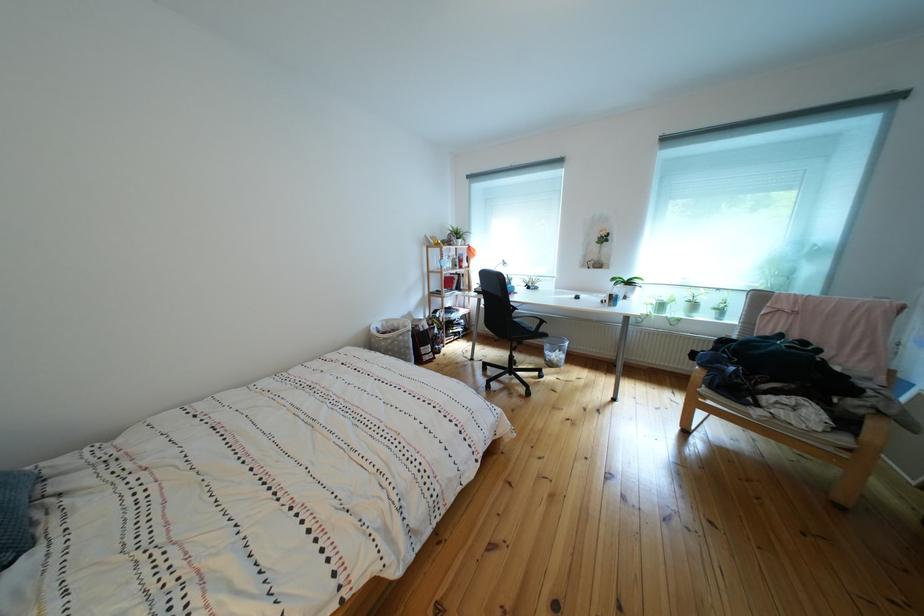
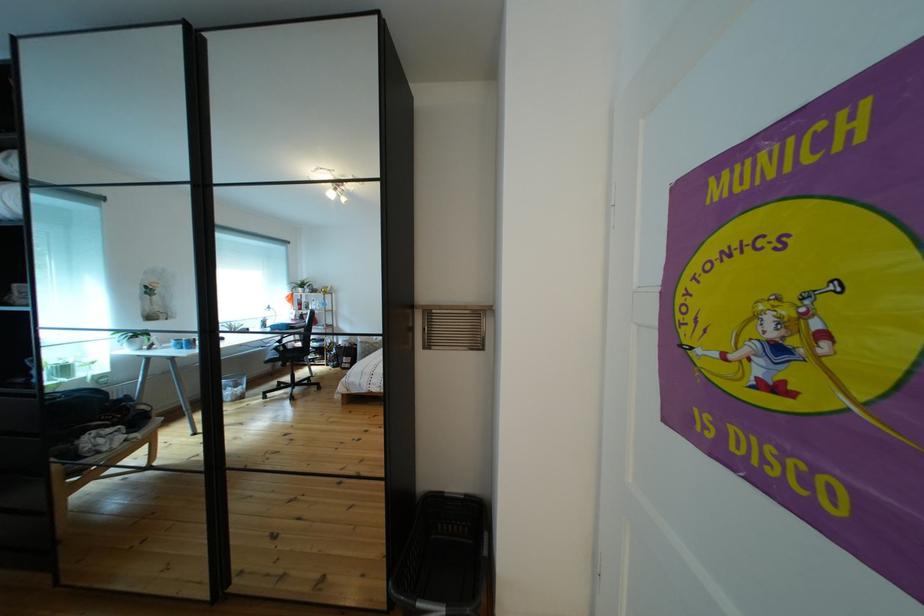
Question: The images are taken continuously from a first-person perspective. In which direction is your viewpoint rotating?

Choices:
 (A) Left
 (B) Right
 (C) Up
 (D) Down

Answer: (B)